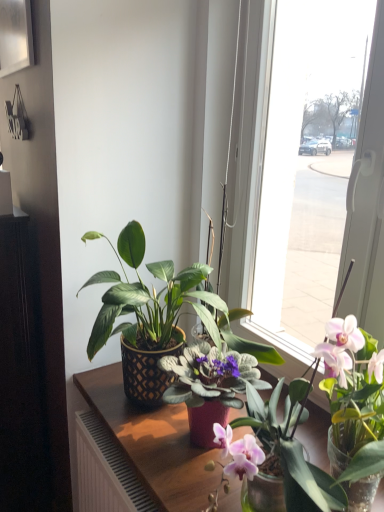
I want to click on metallic silver picture frame at upper left, so click(15, 36).

Find the location of `matte black pot at center`. matte black pot at center is located at coordinates (332, 419).

The height and width of the screenshot is (512, 384). What are the coordinates of `wooden table at center` in the screenshot? It's located at (152, 441).

Where is `metallic silver picture frame at upper left`? metallic silver picture frame at upper left is located at coordinates (15, 36).

How many degrees apart are the facing directions of wooden table at center and matte black pot at center?

They differ by 6.66e-05 degrees in their facing directions.

Between point (100, 415) and point (342, 362), which one is positioned behind?

The point (100, 415) is farther from the camera.

Is wooden table at center inside or outside of matte black pot at center?

wooden table at center is outside matte black pot at center.

Is wooden table at center to the left of matte black pot at center from the viewer's perspective?

Yes, wooden table at center is to the left of matte black pot at center.

Is metallic silver picture frame at upper left inside or outside of matte black pot at center?

metallic silver picture frame at upper left is spatially situated outside matte black pot at center.

Is metallic silver picture frame at upper left facing away from matte black pot at center?

That's not correct — metallic silver picture frame at upper left is not looking away from matte black pot at center.

Considering the sizes of objects metallic silver picture frame at upper left and matte black pot at center in the image provided, who is thinner, metallic silver picture frame at upper left or matte black pot at center?

metallic silver picture frame at upper left is thinner.

In the scene shown: Measure the distance from wooden table at center to metallic silver picture frame at upper left.

They are 3.88 feet apart.

Is wooden table at center smaller than metallic silver picture frame at upper left?

No.

Is wooden table at center shorter than metallic silver picture frame at upper left?

No, wooden table at center is not shorter than metallic silver picture frame at upper left.

From a real-world perspective, which object rests below the other?

wooden table at center, from a real-world perspective.

Does metallic silver picture frame at upper left touch wooden table at center?

No, metallic silver picture frame at upper left is not touching wooden table at center.

Does metallic silver picture frame at upper left contain wooden table at center?

No, wooden table at center is not surrounded by metallic silver picture frame at upper left.

Is metallic silver picture frame at upper left wider than wooden table at center?

No, metallic silver picture frame at upper left is not wider than wooden table at center.

How different are the orientations of metallic silver picture frame at upper left and wooden table at center in degrees?

The angle between the facing direction of metallic silver picture frame at upper left and the facing direction of wooden table at center is 1.17 degrees.

Who is bigger, matte black pot at center or wooden table at center?

wooden table at center is bigger.

From the image's perspective, is matte black pot at center on top of wooden table at center?

Yes, from the image's perspective, matte black pot at center is on top of wooden table at center.

Does point (250, 414) come closer to viewer compared to point (141, 460)?

That is True.

How much distance is there between matte black pot at center and metallic silver picture frame at upper left?

4.35 feet.

Is the position of matte black pot at center less distant than that of metallic silver picture frame at upper left?

Yes, it is.

From a real-world perspective, who is located higher, matte black pot at center or metallic silver picture frame at upper left?

metallic silver picture frame at upper left.

Is matte black pot at center not within metallic silver picture frame at upper left?

That's correct, matte black pot at center is outside of metallic silver picture frame at upper left.

Where is `table that appears on the left of matte black pot at center`? This screenshot has width=384, height=512. table that appears on the left of matte black pot at center is located at coordinates (152, 441).

The height and width of the screenshot is (512, 384). In order to click on houseplant that appears on the right of metallic silver picture frame at upper left in this screenshot , I will do `click(332, 419)`.

Estimate the real-world distances between objects in this image. Which object is closer to wooden table at center, metallic silver picture frame at upper left or matte black pot at center?

matte black pot at center is positioned closer to the anchor wooden table at center.

Which object lies nearer to the anchor point metallic silver picture frame at upper left, wooden table at center or matte black pot at center?

Based on the image, wooden table at center appears to be nearer to metallic silver picture frame at upper left.

Which object lies nearer to the anchor point matte black pot at center, metallic silver picture frame at upper left or wooden table at center?

Among the two, wooden table at center is located nearer to matte black pot at center.

From the image, which object appears to be nearer to matte black pot at center, wooden table at center or metallic silver picture frame at upper left?

Among the two, wooden table at center is located nearer to matte black pot at center.

Looking at the image, which one is located further to metallic silver picture frame at upper left, matte black pot at center or wooden table at center?

matte black pot at center is further to metallic silver picture frame at upper left.

Considering their positions, is matte black pot at center positioned closer to wooden table at center than metallic silver picture frame at upper left?

matte black pot at center.

The height and width of the screenshot is (512, 384). Find the location of `houseplant between metallic silver picture frame at upper left and wooden table at center in the vertical direction`. houseplant between metallic silver picture frame at upper left and wooden table at center in the vertical direction is located at coordinates (332, 419).